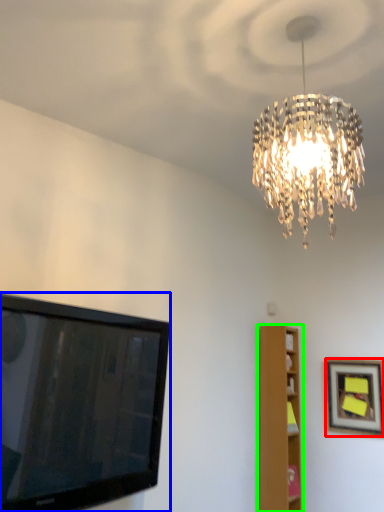
Question: Based on their relative distances, which object is nearer to picture frame (highlighted by a red box)? Choose from television (highlighted by a blue box) and furniture (highlighted by a green box).

Choices:
 (A) television
 (B) furniture

Answer: (B)